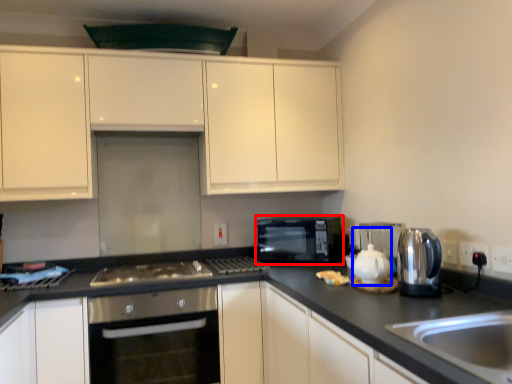
Question: Which object appears closest to the camera in this image, microwave oven (highlighted by a red box) or tea pot (highlighted by a blue box)?

Choices:
 (A) microwave oven
 (B) tea pot

Answer: (B)